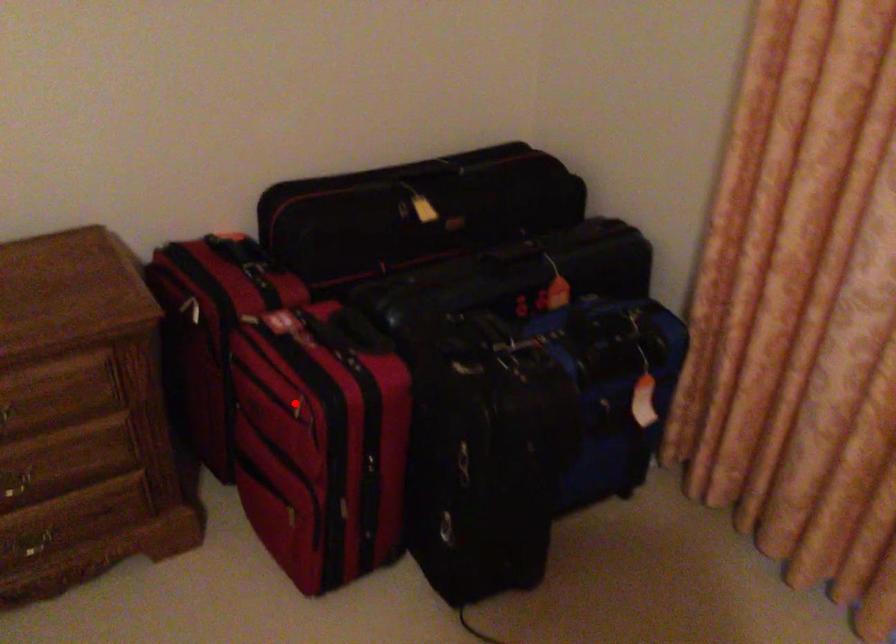
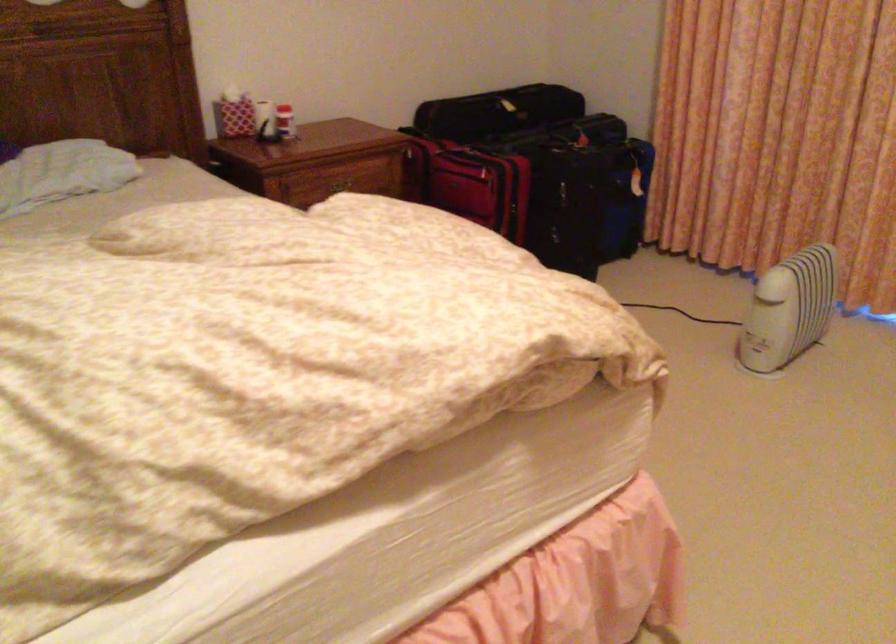
Where in the second image is the point corresponding to the highlighted location from the first image?

(469, 183)